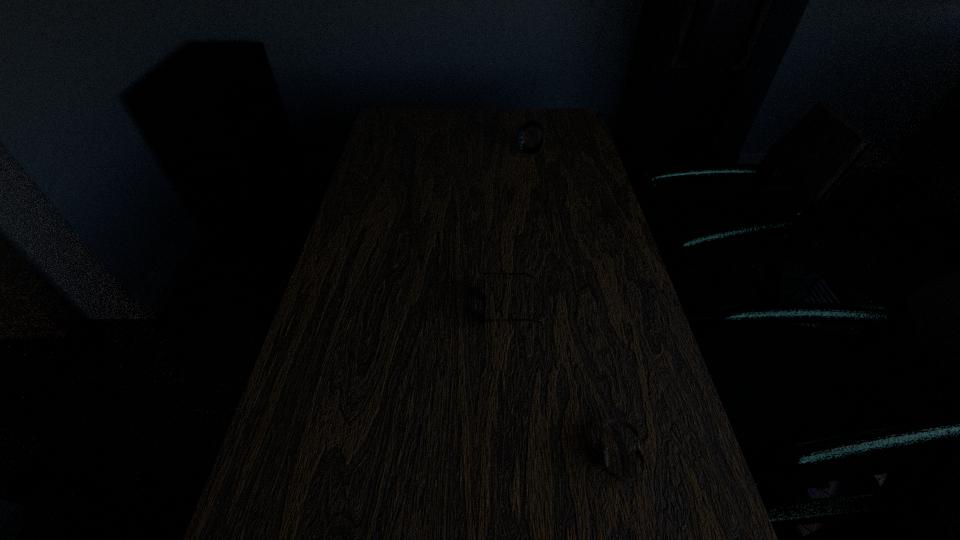
Where is `vacant space located 0.190m at the front view of the second nearest object`? This screenshot has width=960, height=540. vacant space located 0.190m at the front view of the second nearest object is located at coordinates (404, 308).

You are a GUI agent. You are given a task and a screenshot of the screen. Output one action in this format:
    pyautogui.click(x=<x>, y=<y>)
    Task: Click on the blank space located 0.240m on the face of the nearest object
    
    Given the screenshot: What is the action you would take?
    pyautogui.click(x=467, y=455)

This screenshot has width=960, height=540. Find the location of `vacant space located 0.250m on the face of the nearest object`. vacant space located 0.250m on the face of the nearest object is located at coordinates (462, 455).

Locate an element on the screen. The image size is (960, 540). vacant space situated on the face of the nearest object is located at coordinates (489, 455).

The image size is (960, 540). In the image, there is a desktop. Identify the location of vacant space at the left edge. (404, 180).

At what (x,y) coordinates should I click in order to perform the action: click on vacant space at the right edge of the desktop. Please return your answer as a coordinate pair (x, y). This screenshot has width=960, height=540. Looking at the image, I should click on (589, 321).

Identify the location of vacant area at the far left corner of the desktop. The width and height of the screenshot is (960, 540). (385, 132).

This screenshot has width=960, height=540. Identify the location of vacant space at the far right corner of the desktop. (542, 119).

At what (x,y) coordinates should I click in order to perform the action: click on free point between the nearest object and the tallest object. Please return your answer as a coordinate pair (x, y). This screenshot has width=960, height=540. Looking at the image, I should click on (574, 303).

Image resolution: width=960 pixels, height=540 pixels. I want to click on empty location between the farthest object and the nearer watch, so click(x=574, y=303).